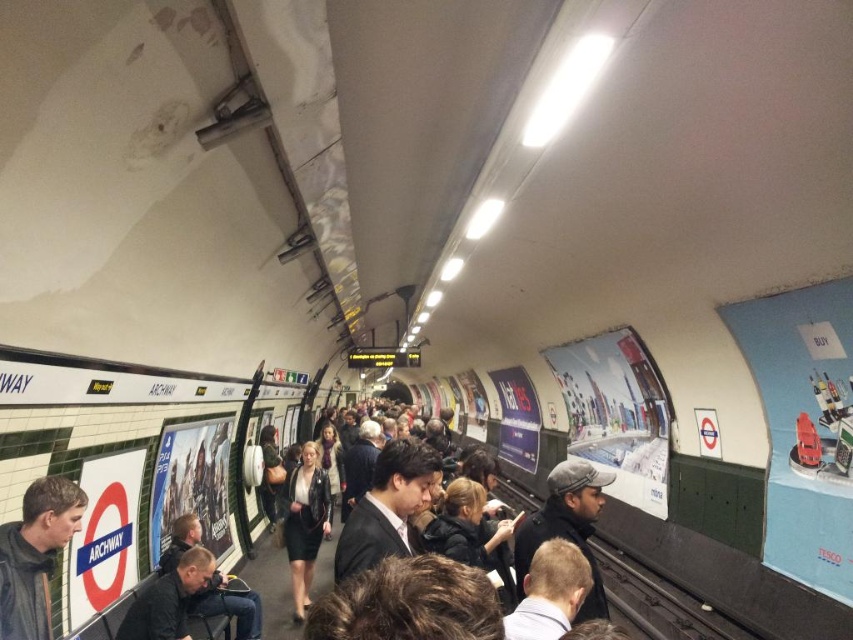
Question: From the image, what is the correct spatial relationship of dark suit at center in relation to dark gray wool hat at center?

Choices:
 (A) right
 (B) left

Answer: (B)

Question: Which object appears closest to the camera in this image?

Choices:
 (A) dark gray jacket at lower left
 (B) dark suit at center

Answer: (A)

Question: Does dark suit at center appear under dark gray wool hat at center?

Choices:
 (A) no
 (B) yes

Answer: (A)

Question: Observing the image, what is the correct spatial positioning of dark gray jacket at lower left in reference to dark gray wool hat at center?

Choices:
 (A) above
 (B) below

Answer: (A)

Question: Which point appears farthest from the camera in this image?

Choices:
 (A) (16, 522)
 (B) (405, 529)

Answer: (B)

Question: Which of the following is the farthest from the observer?

Choices:
 (A) (598, 497)
 (B) (36, 541)

Answer: (A)